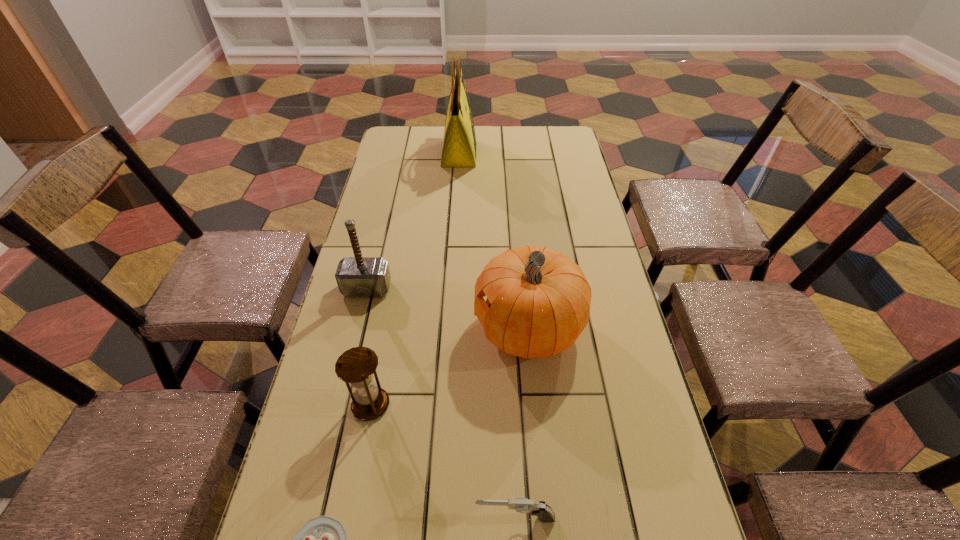
Find the location of a particular element. This screenshot has height=540, width=960. vacant area that lies between the second shortest object and the pumpkin is located at coordinates (522, 423).

You are a GUI agent. You are given a task and a screenshot of the screen. Output one action in this format:
    pyautogui.click(x=<x>, y=<y>)
    Task: Click on the free area in between the gun and the hammer
    
    Given the screenshot: What is the action you would take?
    pyautogui.click(x=441, y=403)

Identify the location of vacant region between the hammer and the hourglass. The width and height of the screenshot is (960, 540). (369, 347).

Select which object appears as the second closest to the hourglass. Please provide its 2D coordinates. Your answer should be formatted as a tuple, i.e. [(x, y)], where the tuple contains the x and y coordinates of a point satisfying the conditions above.

[(538, 301)]

Find the location of a particular element. the third closest object to the fourth farthest object is located at coordinates point(544,512).

Locate an element on the screen. blank area in the image that satisfies the following two spatial constraints: 1. on the front-facing side of the farthest object; 2. on the front side of the hammer is located at coordinates (450, 288).